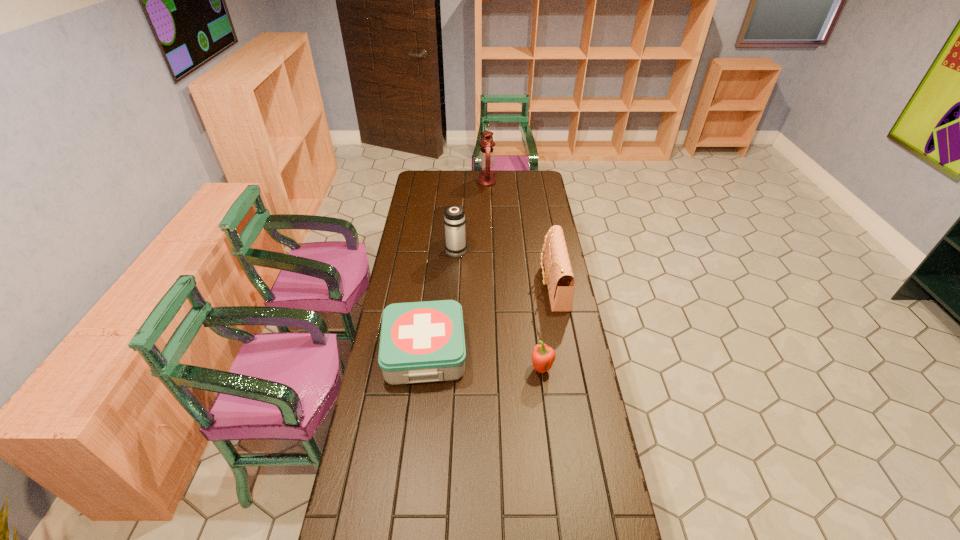
You are a GUI agent. You are given a task and a screenshot of the screen. Output one action in this format:
    pyautogui.click(x=<x>, y=<y>)
    Task: Click on the free space located 0.260m on the front-facing side of the third farthest object
    The width and height of the screenshot is (960, 540).
    Given the screenshot: What is the action you would take?
    pyautogui.click(x=480, y=285)

In order to click on vacant region located 0.260m on the front-facing side of the third farthest object in this screenshot , I will do `click(480, 285)`.

Find the location of a particular element. The width and height of the screenshot is (960, 540). blank area located 0.050m on the front-facing side of the third farthest object is located at coordinates (528, 285).

Locate an element on the screen. free region located on the front of the pepper is located at coordinates (555, 480).

Where is `vacant space located on the right of the first-aid kit`? vacant space located on the right of the first-aid kit is located at coordinates (518, 353).

You are a GUI agent. You are given a task and a screenshot of the screen. Output one action in this format:
    pyautogui.click(x=<x>, y=<y>)
    Task: Click on the object present at the far edge
    
    Given the screenshot: What is the action you would take?
    pyautogui.click(x=486, y=158)

Identify the location of object that is at the left edge. This screenshot has height=540, width=960. (420, 342).

This screenshot has width=960, height=540. I want to click on handbag that is positioned at the right edge, so click(x=559, y=278).

At what (x,y) coordinates should I click in order to perform the action: click on pepper located at the right edge. Please return your answer as a coordinate pair (x, y). Image resolution: width=960 pixels, height=540 pixels. Looking at the image, I should click on (543, 356).

In the image, there is a desktop. Identify the location of free space at the far edge. This screenshot has height=540, width=960. (455, 172).